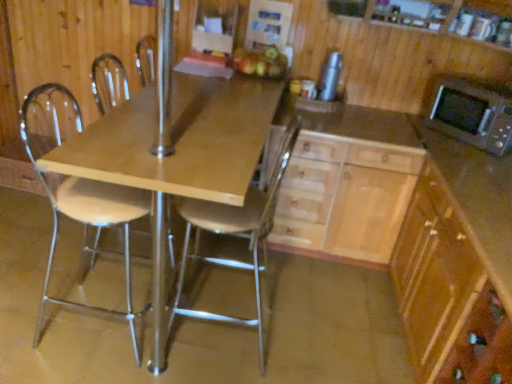
Find the location of a particular element. free space in front of silver metallic thermos at upper right is located at coordinates (321, 108).